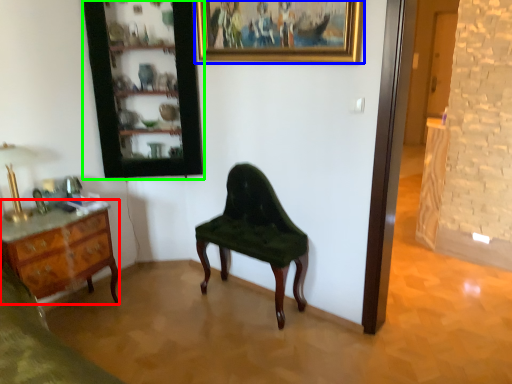
Question: Which object is the farthest from desk (highlighted by a red box)? Choose among these: picture frame (highlighted by a blue box) or cabinetry (highlighted by a green box).

Choices:
 (A) picture frame
 (B) cabinetry

Answer: (A)